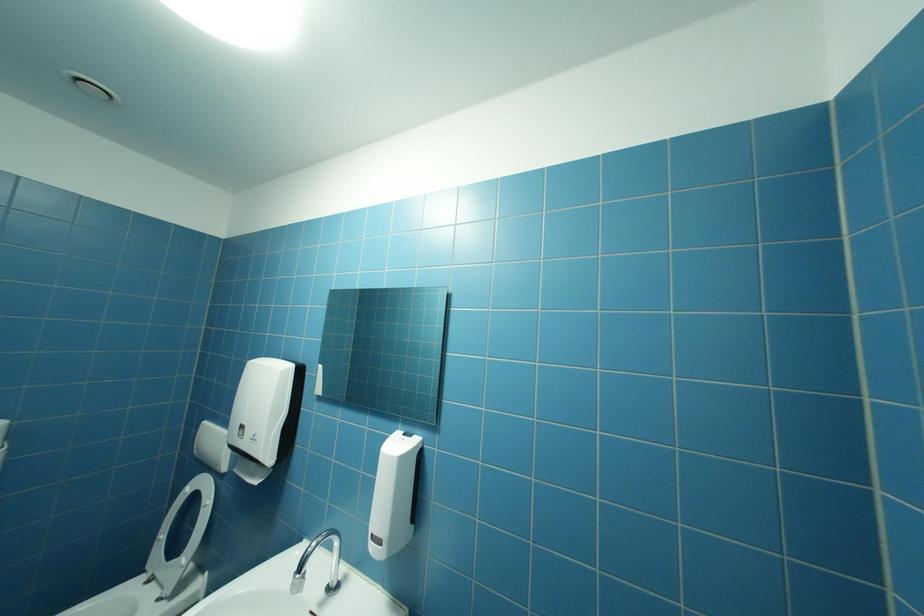
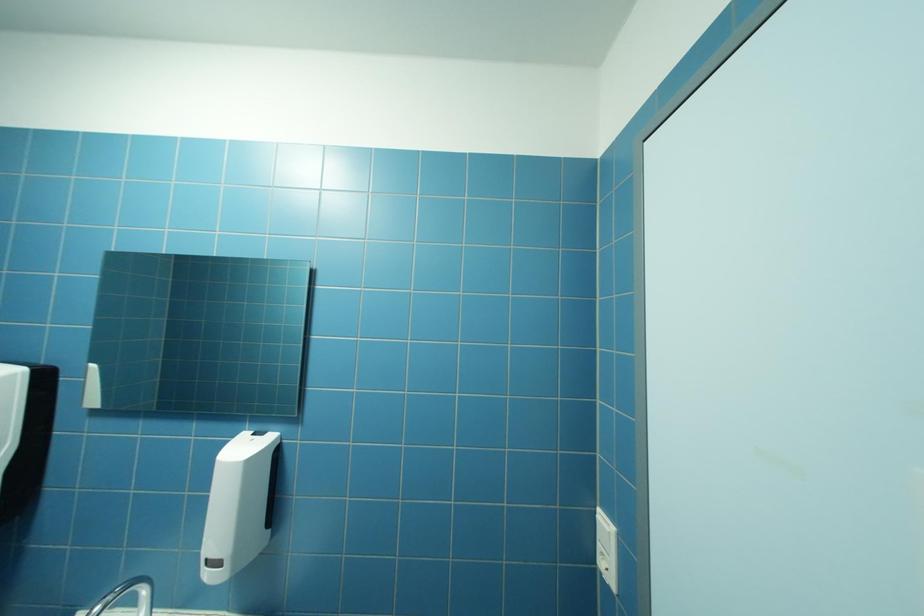
Question: Based on the continuous images, in which direction is the camera rotating? Reply with the corresponding letter.

Choices:
 (A) Left
 (B) Right
 (C) Up
 (D) Down

Answer: (B)